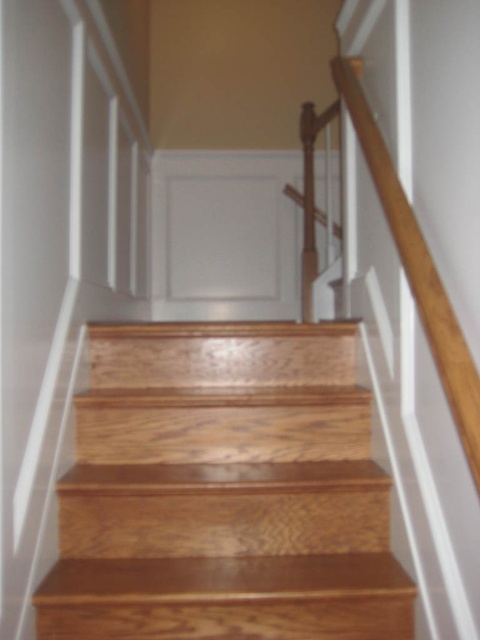
You are a delivery person carrying a large package and need to ascend the wooden stairs at center. The wooden handrail at upper right is available for support. Considering their sizes, which object should you use to ensure stability?

The wooden stairs at center has a larger size compared to the wooden handrail at upper right, so you should use the wooden stairs at center for stability as they provide a broader and more secure base for climbing.

You are standing at the bottom of the staircase and want to reach the point marked as point (224, 492). Which direction should you walk to reach it?

The point (224, 492) is located on the wooden stairs at center, so you should walk upwards along the wooden stairs at center to reach it.